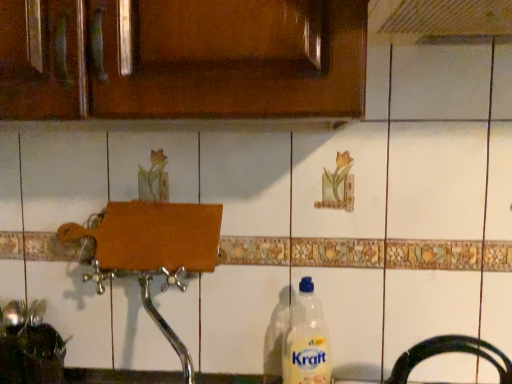
Question: From their relative heights in the image, would you say brown wood cabinet at upper center is taller or shorter than translucent plastic bottle at lower center?

Choices:
 (A) tall
 (B) short

Answer: (B)

Question: Relative to translucent plastic bottle at lower center, is brown wood cabinet at upper center in front or behind?

Choices:
 (A) front
 (B) behind

Answer: (A)

Question: From a real-world perspective, relative to translucent plastic bottle at lower center, is brown wood cabinet at upper center vertically above or below?

Choices:
 (A) below
 (B) above

Answer: (B)

Question: Considering the positions of translucent plastic bottle at lower center and brown wood cabinet at upper center in the image, is translucent plastic bottle at lower center taller or shorter than brown wood cabinet at upper center?

Choices:
 (A) tall
 (B) short

Answer: (A)

Question: From the image's perspective, is translucent plastic bottle at lower center above or below brown wood cabinet at upper center?

Choices:
 (A) below
 (B) above

Answer: (A)

Question: In terms of width, does translucent plastic bottle at lower center look wider or thinner when compared to brown wood cabinet at upper center?

Choices:
 (A) wide
 (B) thin

Answer: (B)

Question: Is translucent plastic bottle at lower center in front of or behind brown wood cabinet at upper center in the image?

Choices:
 (A) front
 (B) behind

Answer: (B)